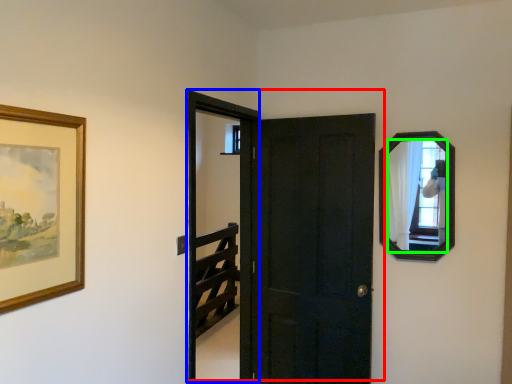
Question: Which is nearer to the door (highlighted by a red box)? screen door (highlighted by a blue box) or mirror (highlighted by a green box).

Choices:
 (A) screen door
 (B) mirror

Answer: (A)